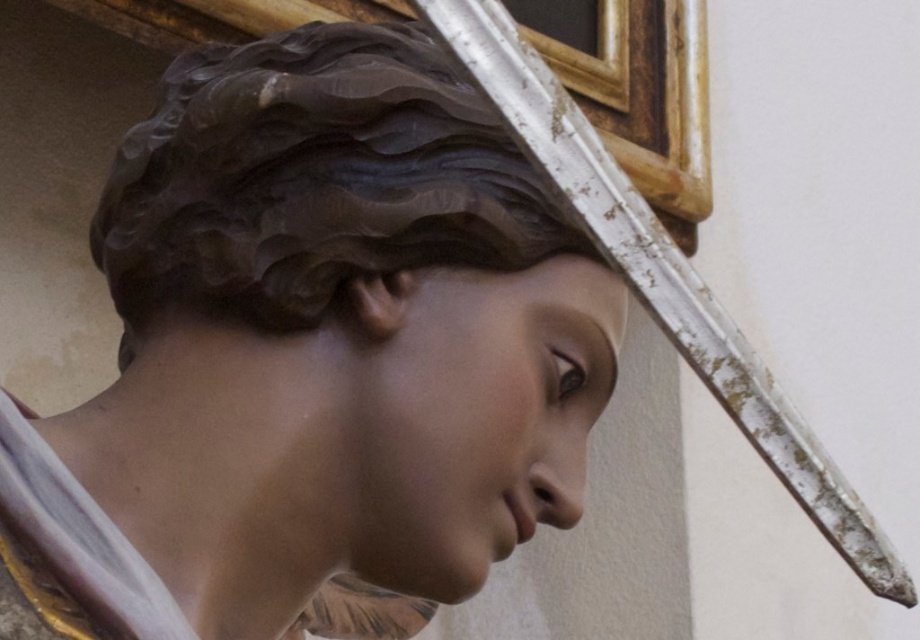
Question: From the image, what is the correct spatial relationship of matte brown statue at center in relation to white weathered wood cross at upper center?

Choices:
 (A) right
 (B) left

Answer: (B)

Question: Which object is farther from the camera taking this photo?

Choices:
 (A) matte brown statue at center
 (B) white weathered wood cross at upper center

Answer: (A)

Question: Which point is farther from the camera taking this photo?

Choices:
 (A) (365, 529)
 (B) (716, 316)

Answer: (A)

Question: Is matte brown statue at center thinner than white weathered wood cross at upper center?

Choices:
 (A) no
 (B) yes

Answer: (A)

Question: Can you confirm if matte brown statue at center is positioned to the right of white weathered wood cross at upper center?

Choices:
 (A) no
 (B) yes

Answer: (A)